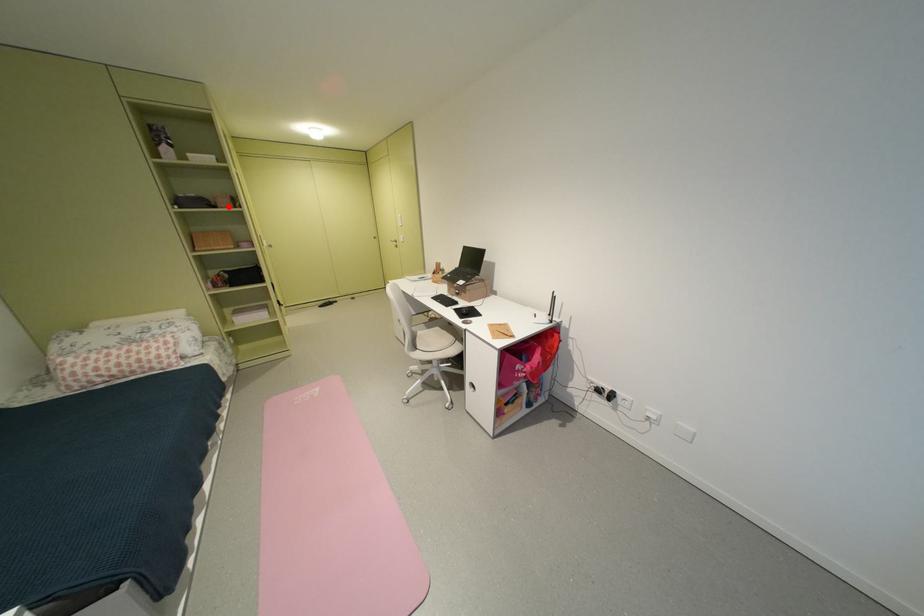
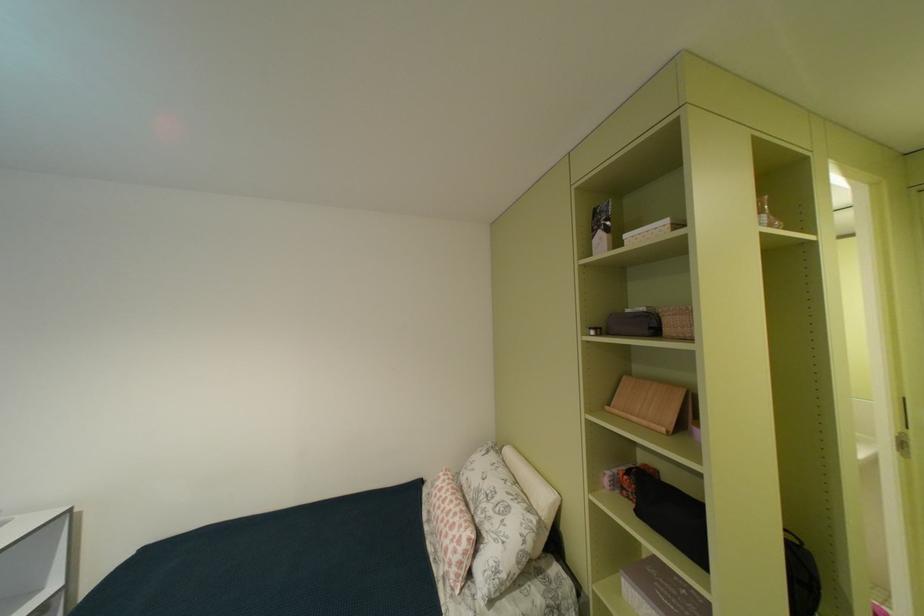
Where in the second image is the point corresponding to the highlighted location from the first image?

(675, 331)